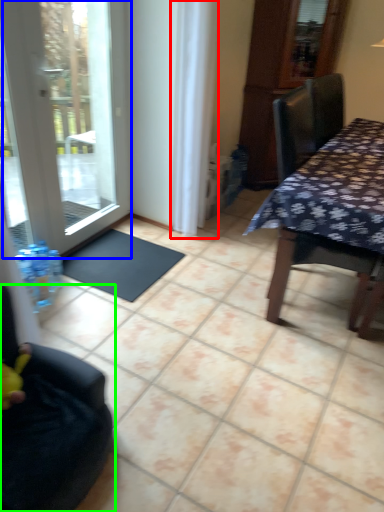
Question: Which object is positioned farthest from curtain (highlighted by a red box)? Select from door (highlighted by a blue box) and chair (highlighted by a green box).

Choices:
 (A) door
 (B) chair

Answer: (B)